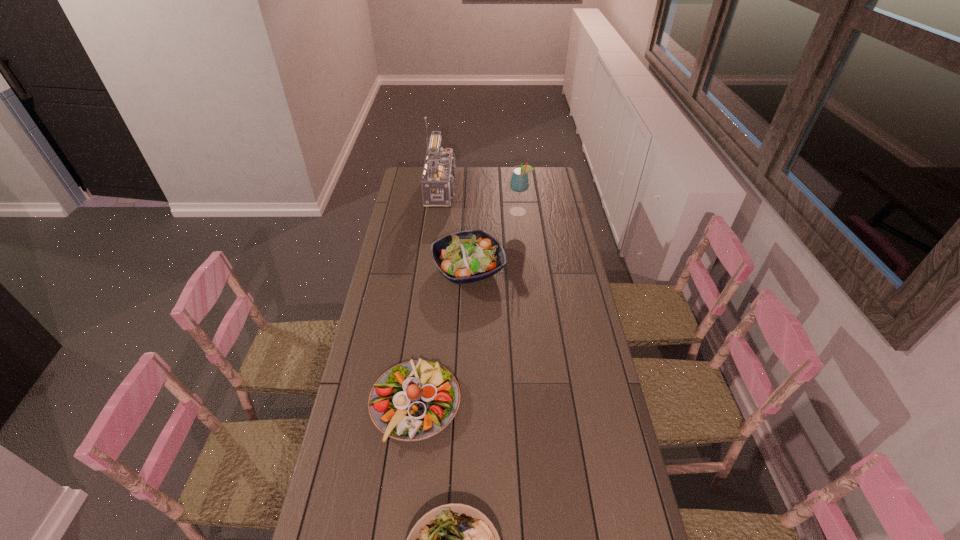
This screenshot has height=540, width=960. In order to click on free space between the second shortest object and the farthest salad plate in this screenshot , I will do `click(442, 336)`.

Locate an element on the screen. free space between the tallest salad plate and the fourth tallest object is located at coordinates (442, 336).

Find the location of a particular element. Image resolution: width=960 pixels, height=540 pixels. free space between the third farthest object and the radio receiver is located at coordinates (457, 229).

Identify which object is the third nearest to the nearest salad plate. Please provide its 2D coordinates. Your answer should be formatted as a tuple, i.e. [(x, y)], where the tuple contains the x and y coordinates of a point satisfying the conditions above.

[(519, 182)]

Locate which object is the third closest to the fourth shortest object. Please provide its 2D coordinates. Your answer should be formatted as a tuple, i.e. [(x, y)], where the tuple contains the x and y coordinates of a point satisfying the conditions above.

[(415, 400)]

Locate which salad plate is the second closest to the nearest salad plate. Please provide its 2D coordinates. Your answer should be formatted as a tuple, i.e. [(x, y)], where the tuple contains the x and y coordinates of a point satisfying the conditions above.

[(468, 256)]

Identify which salad plate is the nearest to the second shortest object. Please provide its 2D coordinates. Your answer should be formatted as a tuple, i.e. [(x, y)], where the tuple contains the x and y coordinates of a point satisfying the conditions above.

[(455, 539)]

Locate an element on the screen. The width and height of the screenshot is (960, 540). free space that satisfies the following two spatial constraints: 1. on the back side of the alcohol; 2. on the left side of the third farthest object is located at coordinates (470, 212).

Image resolution: width=960 pixels, height=540 pixels. I want to click on vacant space that satisfies the following two spatial constraints: 1. on the front-facing side of the radio receiver; 2. on the left side of the tallest salad plate, so click(x=438, y=269).

Identify the location of free space that satisfies the following two spatial constraints: 1. on the back side of the second shortest object; 2. on the right side of the second tallest object. (439, 212).